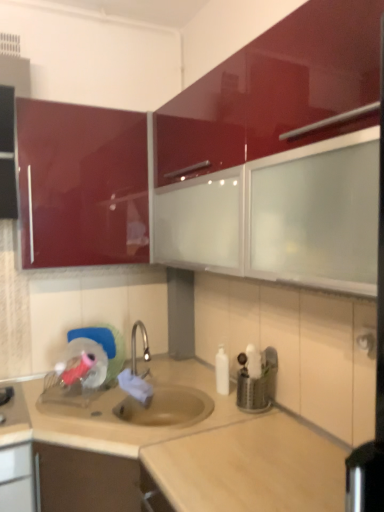
Question: Is glossy red cabinet at upper center, the first cabinetry positioned from the right, positioned with its back to beige laminate countertop at center?

Choices:
 (A) no
 (B) yes

Answer: (A)

Question: Is glossy red cabinet at upper center, which is the second cabinetry from left to right, next to beige laminate countertop at center and touching it?

Choices:
 (A) no
 (B) yes

Answer: (A)

Question: Would you say glossy red cabinet at upper center, the first cabinetry positioned from the right, is outside beige laminate countertop at center?

Choices:
 (A) yes
 (B) no

Answer: (A)

Question: Considering the relative sizes of glossy red cabinet at upper center, which is the second cabinetry from left to right, and beige laminate countertop at center in the image provided, is glossy red cabinet at upper center, which is the second cabinetry from left to right, taller than beige laminate countertop at center?

Choices:
 (A) no
 (B) yes

Answer: (A)

Question: From a real-world perspective, is glossy red cabinet at upper center, the first cabinetry positioned from the right, located beneath beige laminate countertop at center?

Choices:
 (A) yes
 (B) no

Answer: (B)

Question: Does glossy red cabinet at upper center, the first cabinetry positioned from the right, have a smaller size compared to beige laminate countertop at center?

Choices:
 (A) no
 (B) yes

Answer: (B)

Question: Can we say glossy red cabinet at upper left, which appears as the second cabinetry when viewed from the right, lies outside metallic silver utensil holder at center?

Choices:
 (A) yes
 (B) no

Answer: (A)

Question: Are glossy red cabinet at upper left, marked as the first cabinetry in a left-to-right arrangement, and metallic silver utensil holder at center making contact?

Choices:
 (A) yes
 (B) no

Answer: (B)

Question: Is glossy red cabinet at upper left, marked as the first cabinetry in a left-to-right arrangement, oriented towards metallic silver utensil holder at center?

Choices:
 (A) yes
 (B) no

Answer: (B)

Question: From the image's perspective, would you say glossy red cabinet at upper left, which appears as the second cabinetry when viewed from the right, is shown under metallic silver utensil holder at center?

Choices:
 (A) yes
 (B) no

Answer: (B)

Question: Is glossy red cabinet at upper left, which appears as the second cabinetry when viewed from the right, not close to metallic silver utensil holder at center?

Choices:
 (A) yes
 (B) no

Answer: (A)

Question: Is metallic silver utensil holder at center surrounded by glossy red cabinet at upper left, which appears as the second cabinetry when viewed from the right?

Choices:
 (A) yes
 (B) no

Answer: (B)

Question: Does beige laminate countertop at center have a lesser height compared to glossy red cabinet at upper center, which is the second cabinetry from left to right?

Choices:
 (A) yes
 (B) no

Answer: (B)